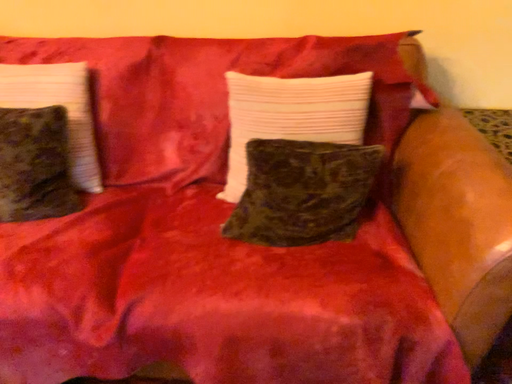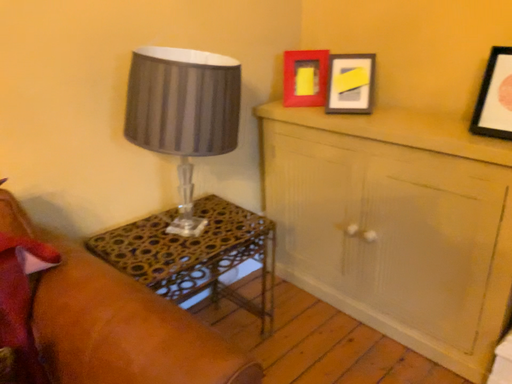
Question: Which way did the camera rotate in the video?

Choices:
 (A) rotated left
 (B) rotated right

Answer: (B)